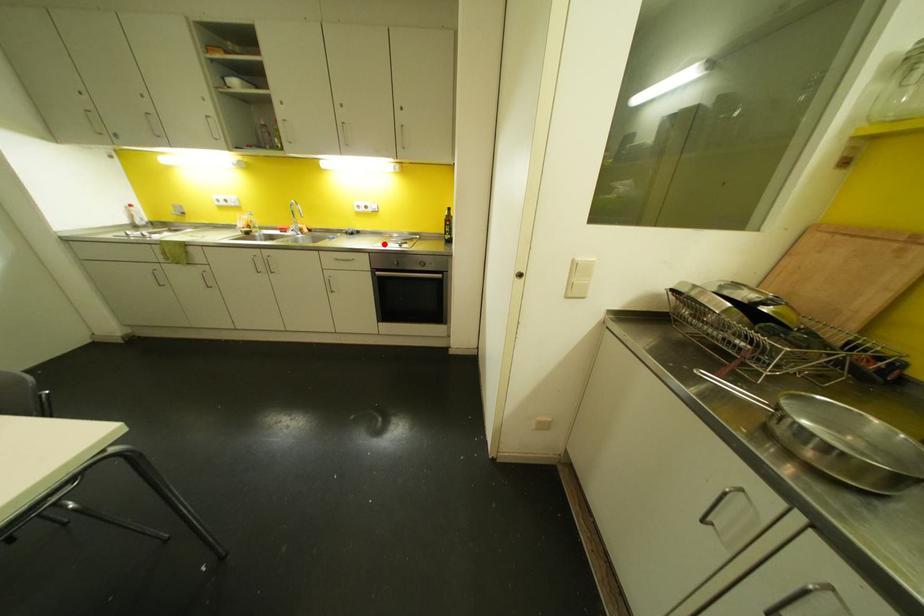
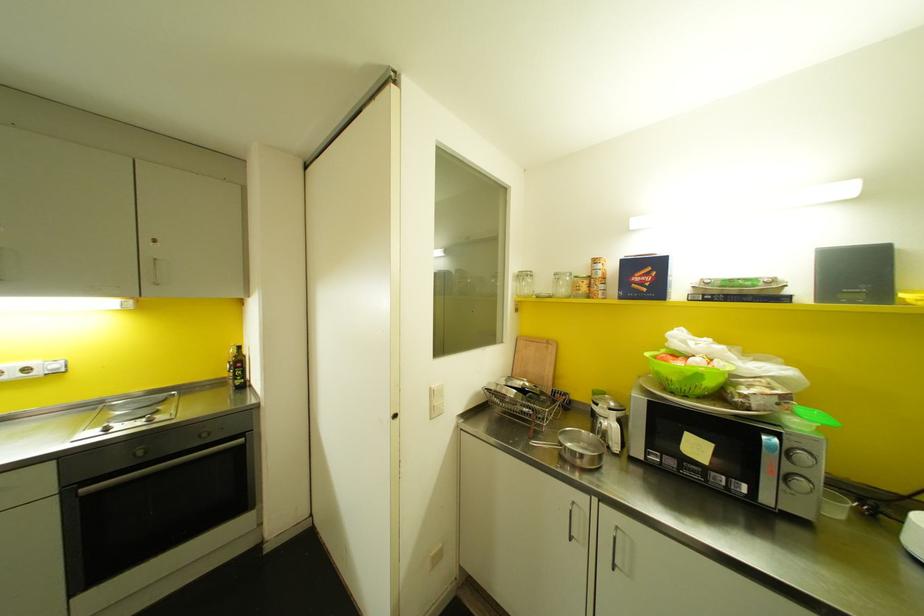
The point at the highlighted location is marked in the first image. Where is the corresponding point in the second image?

(106, 429)